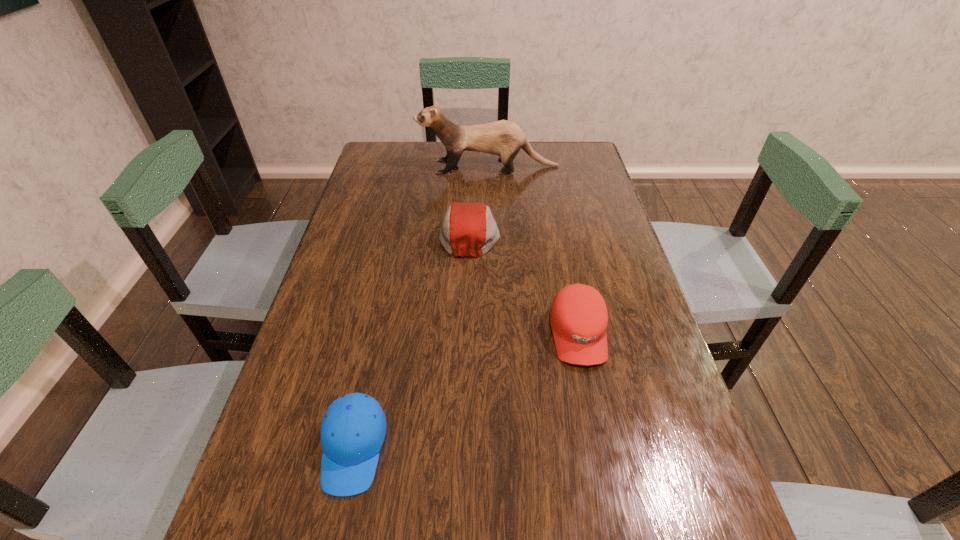
What are the coordinates of `vacant space located on the face of the ferret` in the screenshot? It's located at (393, 166).

The width and height of the screenshot is (960, 540). What are the coordinates of `vacant region located 0.260m on the front-facing side of the second cap from right to left` in the screenshot? It's located at (588, 234).

The width and height of the screenshot is (960, 540). I want to click on free space located on the front-facing side of the rightmost cap, so click(x=595, y=418).

Find the location of a particular element. The height and width of the screenshot is (540, 960). object that is positioned at the far edge is located at coordinates (504, 138).

Image resolution: width=960 pixels, height=540 pixels. Find the location of `object present at the left edge`. object present at the left edge is located at coordinates (353, 430).

I want to click on ferret at the right edge, so click(x=504, y=138).

Find the location of a particular element. cap that is at the right edge is located at coordinates (578, 316).

I want to click on object that is at the far right corner, so click(504, 138).

What are the coordinates of `vacant area at the far edge` in the screenshot? It's located at (534, 150).

In the image, there is a desktop. Identify the location of vacant space at the left edge. This screenshot has height=540, width=960. (321, 426).